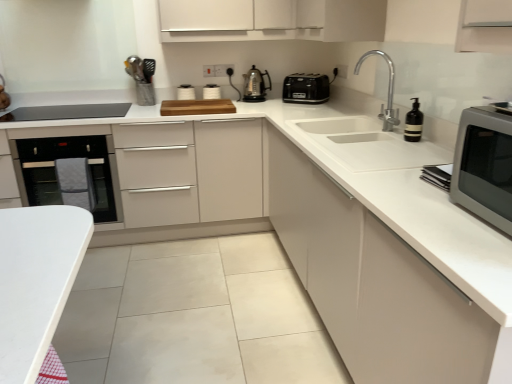
Question: Does black glass oven at left have a smaller size compared to white glossy toaster at upper center?

Choices:
 (A) no
 (B) yes

Answer: (A)

Question: From a real-world perspective, is black glass oven at left under white glossy toaster at upper center?

Choices:
 (A) no
 (B) yes

Answer: (B)

Question: Is black glass oven at left positioned behind white glossy toaster at upper center?

Choices:
 (A) no
 (B) yes

Answer: (A)

Question: Considering the relative sizes of black glass oven at left and white glossy toaster at upper center in the image provided, is black glass oven at left taller than white glossy toaster at upper center?

Choices:
 (A) no
 (B) yes

Answer: (B)

Question: Does black glass oven at left appear on the left side of white glossy toaster at upper center?

Choices:
 (A) yes
 (B) no

Answer: (A)

Question: Is black glass oven at left bigger or smaller than polished chrome faucet at upper right?

Choices:
 (A) small
 (B) big

Answer: (B)

Question: Considering the positions of point click(121, 216) and point click(389, 125), is point click(121, 216) closer or farther from the camera than point click(389, 125)?

Choices:
 (A) farther
 (B) closer

Answer: (A)

Question: From the image's perspective, relative to polished chrome faucet at upper right, is black glass oven at left above or below?

Choices:
 (A) above
 (B) below

Answer: (B)

Question: Considering the positions of black glass oven at left and polished chrome faucet at upper right in the image, is black glass oven at left taller or shorter than polished chrome faucet at upper right?

Choices:
 (A) short
 (B) tall

Answer: (B)

Question: From the image's perspective, is white matte cabinet at center, marked as the third cabinetry in a left-to-right arrangement, above or below black plastic toaster at upper center, the 1th kitchen appliance in the right-to-left sequence?

Choices:
 (A) below
 (B) above

Answer: (A)

Question: Is white matte cabinet at center, marked as the third cabinetry in a left-to-right arrangement, wider or thinner than black plastic toaster at upper center, which ranks as the 2th kitchen appliance in left-to-right order?

Choices:
 (A) thin
 (B) wide

Answer: (B)

Question: From a real-world perspective, is white matte cabinet at center, which appears as the first cabinetry when viewed from the right, positioned above or below black plastic toaster at upper center, the 1th kitchen appliance in the right-to-left sequence?

Choices:
 (A) above
 (B) below

Answer: (B)

Question: Is point (452, 304) positioned closer to the camera than point (317, 81)?

Choices:
 (A) closer
 (B) farther

Answer: (A)

Question: Would you say white matte cabinet at center, marked as the third cabinetry in a left-to-right arrangement, is to the left or to the right of white matte cabinet at upper center, marked as the 2th cabinetry in a left-to-right arrangement, in the picture?

Choices:
 (A) right
 (B) left

Answer: (A)

Question: In the image, is white matte cabinet at center, marked as the third cabinetry in a left-to-right arrangement, positioned in front of or behind white matte cabinet at upper center, the 2th cabinetry in the right-to-left sequence?

Choices:
 (A) front
 (B) behind

Answer: (A)